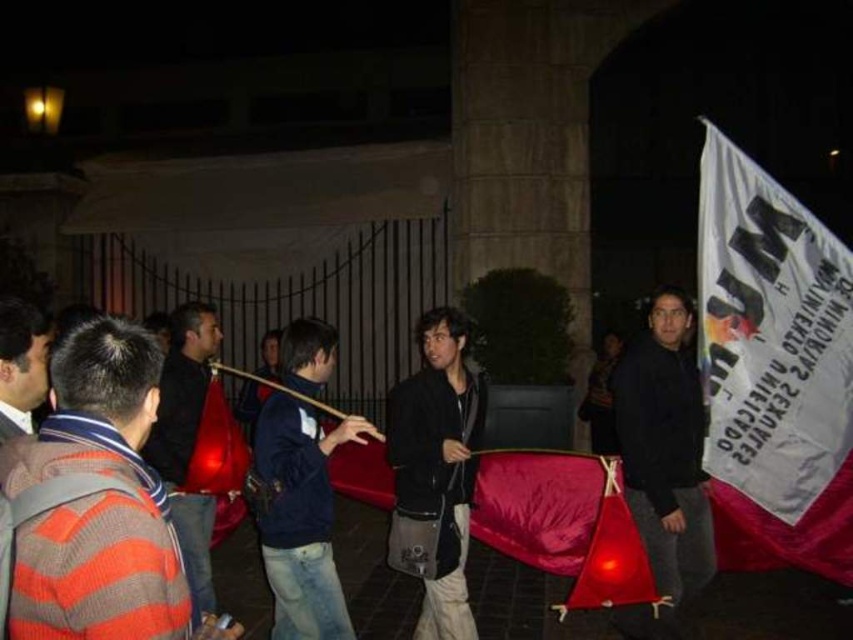
You are a photographer standing at the center of the scene. You want to take a photo of the navy blue jacket at center. Where should you aim your camera to capture it?

You should aim your camera at point (299, 515) to capture the navy blue jacket at center.

You are a photographer trying to capture the protest scene. You want to ensure that both the white fabric banner at right and the navy blue jacket at center are clearly visible in your photo. Given their sizes, which object should you focus on to ensure it remains in frame even if you adjust the camera angle slightly?

Answer: The white fabric banner at right is bigger than the navy blue jacket at center, so focusing on the white fabric banner at right would be more likely to stay in frame even with slight adjustments to the camera angle due to its larger size.

You are a photographer trying to capture a clear shot of the dark gray leather jacket at center and the white fabric banner at right. Since the scene is dimly lit, you need to adjust your camera to focus on both subjects. Which object should you focus on first to ensure proper exposure, considering their positions?

The white fabric banner at right should be focused on first because it is positioned on the right side of the dark gray leather jacket at center, making it farther away and thus requiring more light for proper exposure.